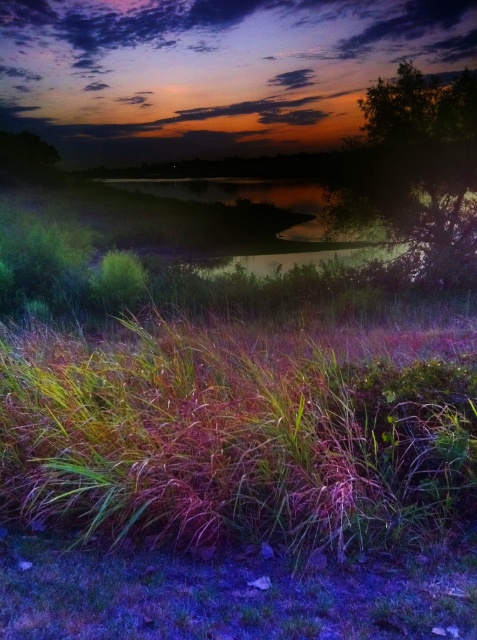
Who is positioned more to the right, green leafy tree at upper right or green leafy tree at upper left?

green leafy tree at upper right

Can you confirm if green leafy tree at upper right is bigger than green leafy tree at upper left?

No, green leafy tree at upper right is not bigger than green leafy tree at upper left.

Between point (415, 179) and point (34, 154), which one is positioned in front?

Positioned in front is point (415, 179).

Locate an element on the screen. green leafy tree at upper right is located at coordinates (414, 173).